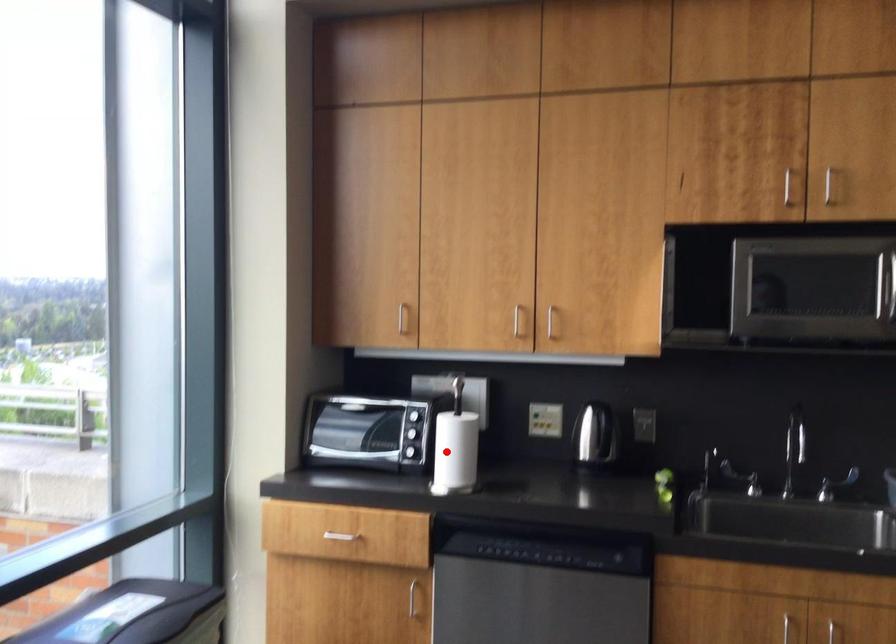
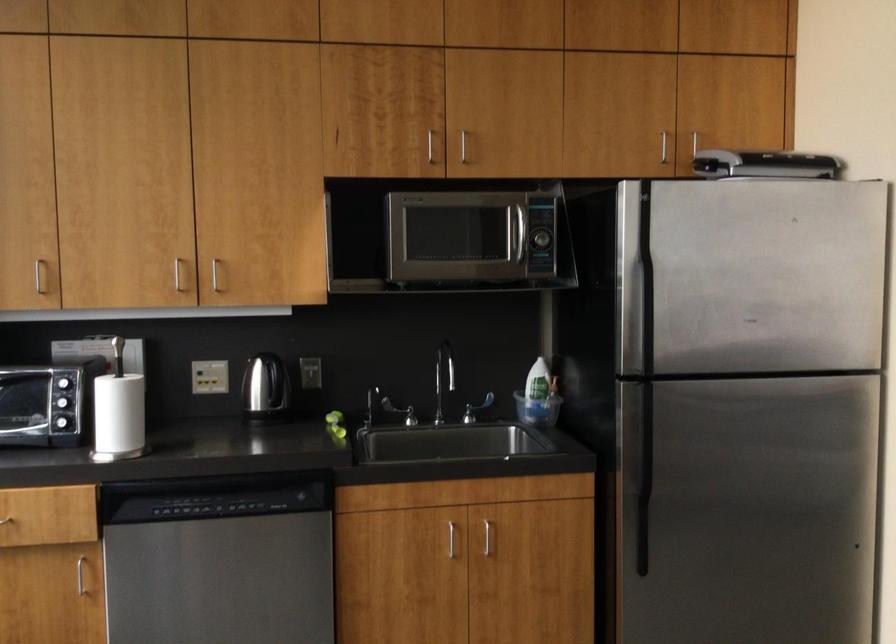
In the second image, find the point that corresponds to the highlighted location in the first image.

(117, 415)